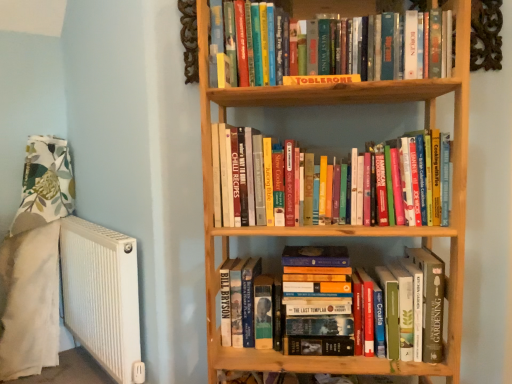
The width and height of the screenshot is (512, 384). I want to click on wooden bookcase at center, so click(x=342, y=225).

What do you see at coordinates (342, 225) in the screenshot? The width and height of the screenshot is (512, 384). I see `wooden bookcase at center` at bounding box center [342, 225].

This screenshot has height=384, width=512. Describe the element at coordinates (422, 299) in the screenshot. I see `hardcover books at lower center, which is the third book from top to bottom` at that location.

Locate an element on the screen. The height and width of the screenshot is (384, 512). yellow cardboard toblerone at upper center, which is the 1th book in top-to-bottom order is located at coordinates (332, 7).

Where is `wooden bookcase at center`? wooden bookcase at center is located at coordinates (342, 225).

Based on their sizes in the image, would you say white ribbed radiator at left is bigger or smaller than hardcover books at lower center, which is the third book from top to bottom?

Considering their sizes, white ribbed radiator at left takes up more space than hardcover books at lower center, which is the third book from top to bottom.

Is point (110, 283) farther from viewer compared to point (315, 349)?

Yes.

Considering the positions of objects white ribbed radiator at left and hardcover books at lower center, which is the first book in bottom-to-top order, in the image provided, who is more to the left, white ribbed radiator at left or hardcover books at lower center, which is the first book in bottom-to-top order,?

From the viewer's perspective, white ribbed radiator at left appears more on the left side.

From a real-world perspective, which is physically below, white ribbed radiator at left or hardcover books at lower center, which is the third book from top to bottom?

From a 3D spatial view, white ribbed radiator at left is below.

From the image's perspective, is hardcover books at lower center, which is the first book in bottom-to-top order, located beneath hardcover books at center, arranged as the 2th book when ordered from the bottom?

Yes, from the image's perspective, hardcover books at lower center, which is the first book in bottom-to-top order, is below hardcover books at center, arranged as the 2th book when ordered from the bottom.

Is hardcover books at lower center, which is the third book from top to bottom, at the right side of hardcover books at center, arranged as the 2th book when ordered from the bottom?

Indeed, hardcover books at lower center, which is the third book from top to bottom, is positioned on the right side of hardcover books at center, arranged as the 2th book when ordered from the bottom.

Considering the sizes of objects hardcover books at lower center, which is the first book in bottom-to-top order, and hardcover books at center, which appears as the 2th book when viewed from the top, in the image provided, who is taller, hardcover books at lower center, which is the first book in bottom-to-top order, or hardcover books at center, which appears as the 2th book when viewed from the top,?

With more height is hardcover books at center, which appears as the 2th book when viewed from the top.

From a real-world perspective, is wooden bookcase at center physically below yellow cardboard toblerone at upper center, which is the 3th book from bottom to top?

Indeed, from a real-world perspective, wooden bookcase at center is positioned beneath yellow cardboard toblerone at upper center, which is the 3th book from bottom to top.

Is point (426, 82) less distant than point (310, 14)?

Yes, point (426, 82) is closer to viewer.

You are a GUI agent. You are given a task and a screenshot of the screen. Output one action in this format:
    pyautogui.click(x=<x>, y=<y>)
    Task: Click on the bookcase that is under the yellow cardboard toblerone at upper center, which is the 1th book in top-to-bottom order (from a real-world perspective)
    The image size is (512, 384).
    Given the screenshot: What is the action you would take?
    pyautogui.click(x=342, y=225)

Which of these two, wooden bookcase at center or yellow cardboard toblerone at upper center, which is the 3th book from bottom to top, is thinner?

yellow cardboard toblerone at upper center, which is the 3th book from bottom to top, is thinner.

In the scene shown: From a real-world perspective, is yellow cardboard toblerone at upper center, which is the 1th book in top-to-bottom order, positioned over wooden bookcase at center based on gravity?

Correct, in the physical world, yellow cardboard toblerone at upper center, which is the 1th book in top-to-bottom order, is higher than wooden bookcase at center.

Is yellow cardboard toblerone at upper center, which is the 1th book in top-to-bottom order, facing away from wooden bookcase at center?

Yes, yellow cardboard toblerone at upper center, which is the 1th book in top-to-bottom order,'s orientation is away from wooden bookcase at center.

In the scene shown: From the image's perspective, relative to wooden bookcase at center, is yellow cardboard toblerone at upper center, which is the 3th book from bottom to top, above or below?

From the image's perspective, yellow cardboard toblerone at upper center, which is the 3th book from bottom to top, appears above wooden bookcase at center.

Is yellow cardboard toblerone at upper center, which is the 1th book in top-to-bottom order, in front of or behind wooden bookcase at center in the image?

Visually, yellow cardboard toblerone at upper center, which is the 1th book in top-to-bottom order, is located behind wooden bookcase at center.

Image resolution: width=512 pixels, height=384 pixels. Identify the location of book lying below the hardcover books at center, which appears as the 2th book when viewed from the top (from the image's perspective). (422, 299).

Is hardcover books at center, which appears as the 2th book when viewed from the top, in front of or behind hardcover books at lower center, which is the third book from top to bottom, in the image?

In the image, hardcover books at center, which appears as the 2th book when viewed from the top, appears in front of hardcover books at lower center, which is the third book from top to bottom.

Is hardcover books at center, which appears as the 2th book when viewed from the top, far away from hardcover books at lower center, which is the third book from top to bottom?

No.

Visually, is hardcover books at center, which appears as the 2th book when viewed from the top, positioned to the left or to the right of hardcover books at lower center, which is the first book in bottom-to-top order?

hardcover books at center, which appears as the 2th book when viewed from the top, is positioned on hardcover books at lower center, which is the first book in bottom-to-top order,'s left side.

Starting from the hardcover books at lower center, which is the first book in bottom-to-top order, which book is the 1st one in front? Please provide its 2D coordinates.

[(332, 7)]

Is the surface of yellow cardboard toblerone at upper center, which is the 1th book in top-to-bottom order, in direct contact with hardcover books at lower center, which is the first book in bottom-to-top order?

yellow cardboard toblerone at upper center, which is the 1th book in top-to-bottom order, and hardcover books at lower center, which is the first book in bottom-to-top order, are clearly separated.

Can you confirm if yellow cardboard toblerone at upper center, which is the 3th book from bottom to top, is positioned to the right of hardcover books at lower center, which is the third book from top to bottom?

Incorrect, yellow cardboard toblerone at upper center, which is the 3th book from bottom to top, is not on the right side of hardcover books at lower center, which is the third book from top to bottom.

Is yellow cardboard toblerone at upper center, which is the 3th book from bottom to top, in front of or behind hardcover books at lower center, which is the first book in bottom-to-top order, in the image?

Visually, yellow cardboard toblerone at upper center, which is the 3th book from bottom to top, is located in front of hardcover books at lower center, which is the first book in bottom-to-top order.

From the image's perspective, is yellow cardboard toblerone at upper center, which is the 1th book in top-to-bottom order, above or below white ribbed radiator at left?

From the image's perspective, yellow cardboard toblerone at upper center, which is the 1th book in top-to-bottom order, appears above white ribbed radiator at left.

Based on the photo, who is smaller, yellow cardboard toblerone at upper center, which is the 3th book from bottom to top, or white ribbed radiator at left?

yellow cardboard toblerone at upper center, which is the 3th book from bottom to top, is smaller.

In terms of height, does yellow cardboard toblerone at upper center, which is the 3th book from bottom to top, look taller or shorter compared to white ribbed radiator at left?

yellow cardboard toblerone at upper center, which is the 3th book from bottom to top, is shorter than white ribbed radiator at left.

You are a GUI agent. You are given a task and a screenshot of the screen. Output one action in this format:
    pyautogui.click(x=<x>, y=<y>)
    Task: Click on the radiator behind the hardcover books at lower center, which is the third book from top to bottom
    The height and width of the screenshot is (384, 512).
    Given the screenshot: What is the action you would take?
    pyautogui.click(x=102, y=295)

You are a GUI agent. You are given a task and a screenshot of the screen. Output one action in this format:
    pyautogui.click(x=<x>, y=<y>)
    Task: Click on the book that is the 2nd one when counting forward from the hardcover books at lower center, which is the third book from top to bottom
    
    Given the screenshot: What is the action you would take?
    pyautogui.click(x=240, y=176)

From the picture: Estimate the real-world distances between objects in this image. Which object is further from wooden bookcase at center, yellow cardboard toblerone at upper center, which is the 3th book from bottom to top, or white ribbed radiator at left?

white ribbed radiator at left lies further to wooden bookcase at center than the other object.

From the image, which object appears to be nearer to hardcover books at lower center, which is the first book in bottom-to-top order, yellow cardboard toblerone at upper center, which is the 3th book from bottom to top, or white ribbed radiator at left?

yellow cardboard toblerone at upper center, which is the 3th book from bottom to top.

When comparing their distances from hardcover books at center, which appears as the 2th book when viewed from the top, does yellow cardboard toblerone at upper center, which is the 1th book in top-to-bottom order, or white ribbed radiator at left seem further?

Based on the image, white ribbed radiator at left appears to be further to hardcover books at center, which appears as the 2th book when viewed from the top.

Estimate the real-world distances between objects in this image. Which object is further from yellow cardboard toblerone at upper center, which is the 3th book from bottom to top, hardcover books at lower center, which is the first book in bottom-to-top order, or hardcover books at center, which appears as the 2th book when viewed from the top?

Among the two, hardcover books at lower center, which is the first book in bottom-to-top order, is located further to yellow cardboard toblerone at upper center, which is the 3th book from bottom to top.

Estimate the real-world distances between objects in this image. Which object is closer to yellow cardboard toblerone at upper center, which is the 3th book from bottom to top, hardcover books at center, which appears as the 2th book when viewed from the top, or wooden bookcase at center?

Based on the image, wooden bookcase at center appears to be nearer to yellow cardboard toblerone at upper center, which is the 3th book from bottom to top.

Looking at the image, which one is located further to wooden bookcase at center, hardcover books at lower center, which is the third book from top to bottom, or hardcover books at center, which appears as the 2th book when viewed from the top?

hardcover books at lower center, which is the third book from top to bottom, is positioned further to the anchor wooden bookcase at center.

Considering their positions, is wooden bookcase at center positioned closer to hardcover books at lower center, which is the third book from top to bottom, than yellow cardboard toblerone at upper center, which is the 1th book in top-to-bottom order?

The object closer to hardcover books at lower center, which is the third book from top to bottom, is wooden bookcase at center.

Looking at the image, which one is located closer to hardcover books at center, arranged as the 2th book when ordered from the bottom, yellow cardboard toblerone at upper center, which is the 1th book in top-to-bottom order, or hardcover books at lower center, which is the third book from top to bottom?

hardcover books at lower center, which is the third book from top to bottom, is positioned closer to the anchor hardcover books at center, arranged as the 2th book when ordered from the bottom.

Locate an element on the screen. Image resolution: width=512 pixels, height=384 pixels. book situated between white ribbed radiator at left and hardcover books at center, which appears as the 2th book when viewed from the top, from left to right is located at coordinates (332, 7).

Find the location of a particular element. book between yellow cardboard toblerone at upper center, which is the 1th book in top-to-bottom order, and wooden bookcase at center vertically is located at coordinates (240, 176).

Locate an element on the screen. Image resolution: width=512 pixels, height=384 pixels. bookcase between hardcover books at center, which appears as the 2th book when viewed from the top, and hardcover books at lower center, which is the first book in bottom-to-top order, in the up-down direction is located at coordinates (342, 225).

This screenshot has width=512, height=384. Identify the location of bookcase between white ribbed radiator at left and hardcover books at lower center, which is the third book from top to bottom, in the horizontal direction. (342, 225).